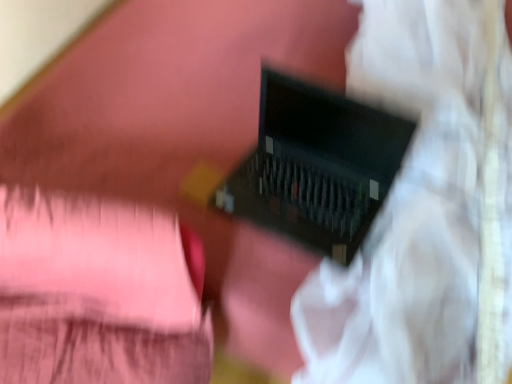
Question: Can you confirm if black plastic computer at center is positioned to the left of matte black laptop at center?

Choices:
 (A) yes
 (B) no

Answer: (A)

Question: Can you confirm if black plastic computer at center is positioned to the right of matte black laptop at center?

Choices:
 (A) yes
 (B) no

Answer: (B)

Question: From the image's perspective, is black plastic computer at center on top of matte black laptop at center?

Choices:
 (A) no
 (B) yes

Answer: (A)

Question: Is black plastic computer at center completely or partially outside of matte black laptop at center?

Choices:
 (A) no
 (B) yes

Answer: (A)

Question: Is black plastic computer at center in front of matte black laptop at center?

Choices:
 (A) no
 (B) yes

Answer: (A)

Question: Can you confirm if black plastic computer at center is wider than matte black laptop at center?

Choices:
 (A) yes
 (B) no

Answer: (B)

Question: Does matte black laptop at center have a larger size compared to black plastic computer at center?

Choices:
 (A) yes
 (B) no

Answer: (A)

Question: Is matte black laptop at center not inside black plastic computer at center?

Choices:
 (A) yes
 (B) no

Answer: (A)

Question: Is matte black laptop at center next to black plastic computer at center?

Choices:
 (A) yes
 (B) no

Answer: (B)

Question: Considering the relative sizes of matte black laptop at center and black plastic computer at center in the image provided, is matte black laptop at center smaller than black plastic computer at center?

Choices:
 (A) yes
 (B) no

Answer: (B)

Question: Does matte black laptop at center lie behind black plastic computer at center?

Choices:
 (A) no
 (B) yes

Answer: (A)

Question: Can you confirm if matte black laptop at center is thinner than black plastic computer at center?

Choices:
 (A) yes
 (B) no

Answer: (B)

Question: Is black plastic computer at center taller or shorter than matte black laptop at center?

Choices:
 (A) tall
 (B) short

Answer: (B)